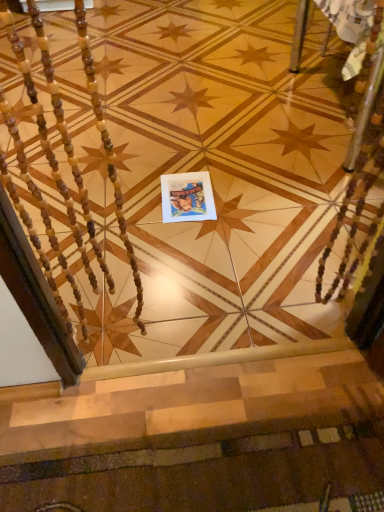
At what (x,y) coordinates should I click in order to perform the action: click on free point above matte paper postcard at center (from a real-world perspective). Please return your answer as a coordinate pair (x, y). Image resolution: width=384 pixels, height=512 pixels. Looking at the image, I should click on (185, 191).